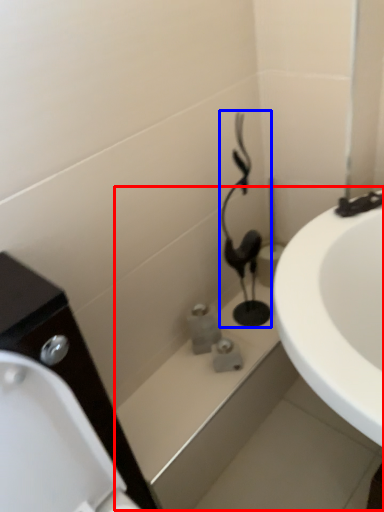
Question: Which object is closer to the camera taking this photo, bath (highlighted by a red box) or plumbing fixture (highlighted by a blue box)?

Choices:
 (A) bath
 (B) plumbing fixture

Answer: (A)